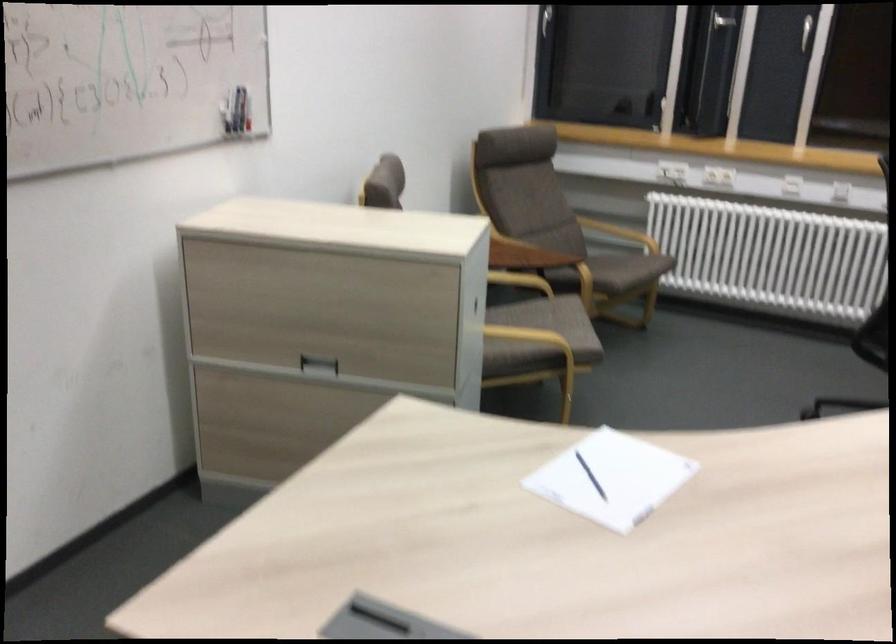
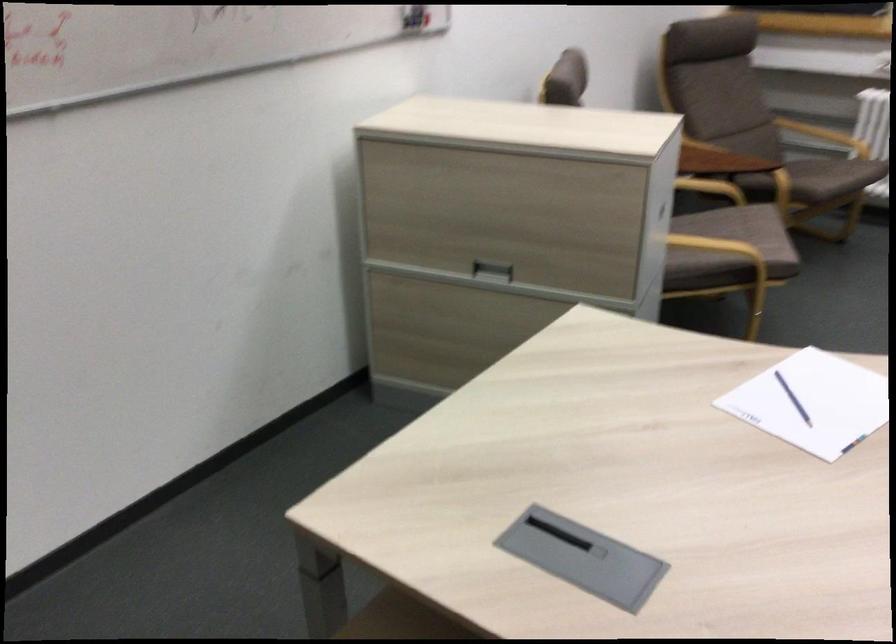
The point at [533,339] is marked in the first image. Where is the corresponding point in the second image?

(721, 249)